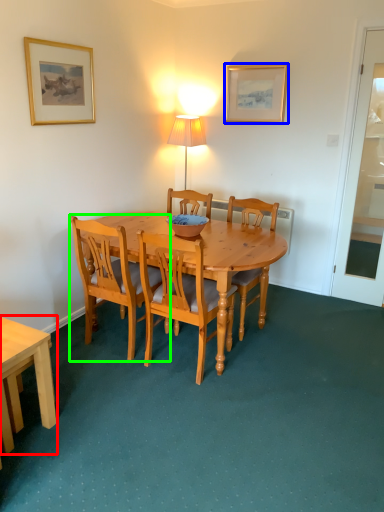
Question: Which object is the closest to the desk (highlighted by a red box)? Choose among these: picture frame (highlighted by a blue box) or chair (highlighted by a green box).

Choices:
 (A) picture frame
 (B) chair

Answer: (B)